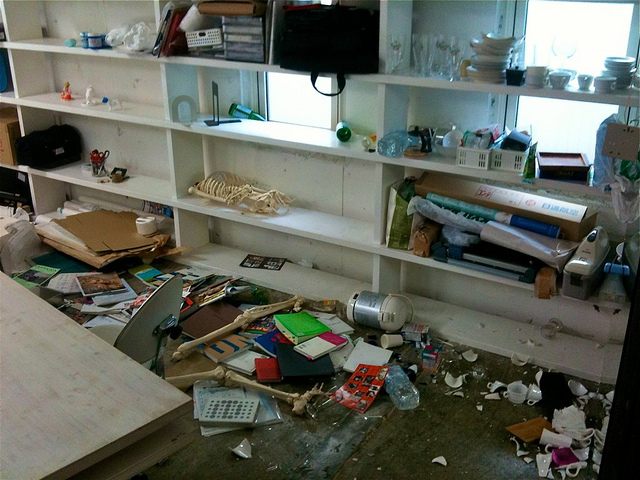
The height and width of the screenshot is (480, 640). Find the location of `wrecked room`. wrecked room is located at coordinates (336, 429).